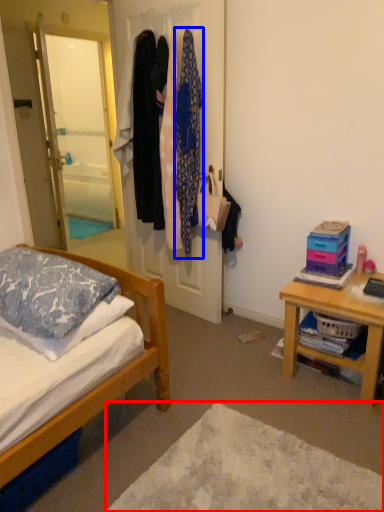
Question: Which of the following is the farthest to the observer, plain (highlighted by a red box) or clothing (highlighted by a blue box)?

Choices:
 (A) plain
 (B) clothing

Answer: (B)